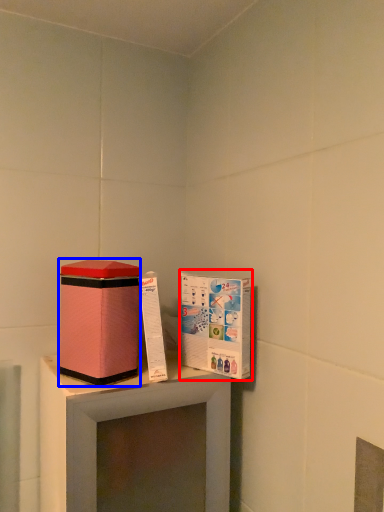
Question: Which of the following is the closest to the observer, cardboard box (highlighted by a red box) or box (highlighted by a blue box)?

Choices:
 (A) cardboard box
 (B) box

Answer: (B)